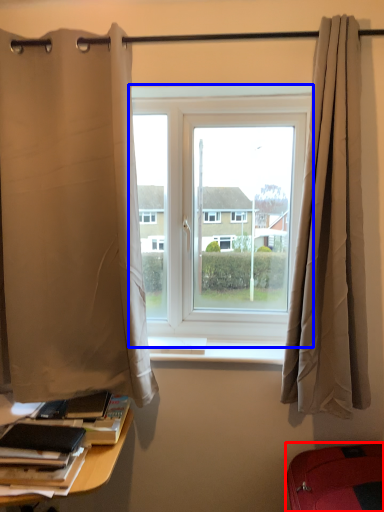
Question: Which point is closer to the camera, furniture (highlighted by a red box) or window (highlighted by a blue box)?

Choices:
 (A) furniture
 (B) window

Answer: (A)